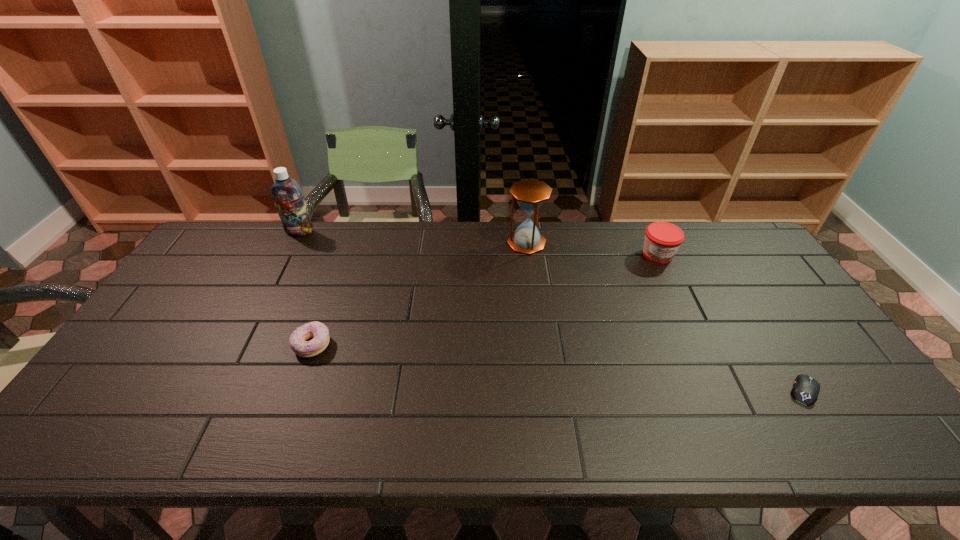
The image size is (960, 540). Find the location of `free point that satisfies the following two spatial constraints: 1. on the front label of the second tallest object; 2. on the left side of the shampoo`. free point that satisfies the following two spatial constraints: 1. on the front label of the second tallest object; 2. on the left side of the shampoo is located at coordinates (294, 243).